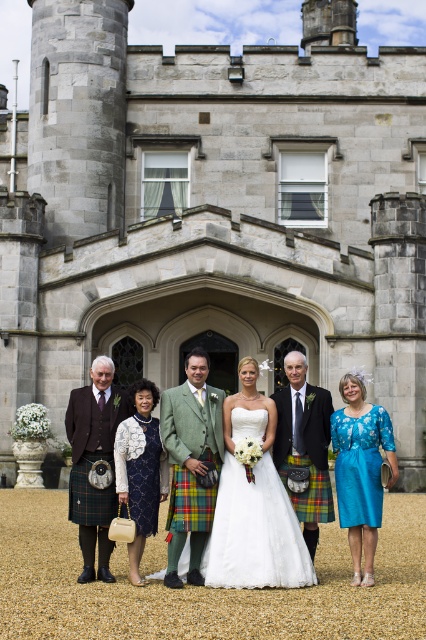
You are a photographer adjusting the camera settings to ensure all wedding attire details are captured clearly. The matte green kilt at center and the turquoise silk dress at lower right are in focus. Which attire has a wider silhouette when viewed from the front?

The matte green kilt at center has a wider silhouette than the turquoise silk dress at lower right because its width surpasses the dress.